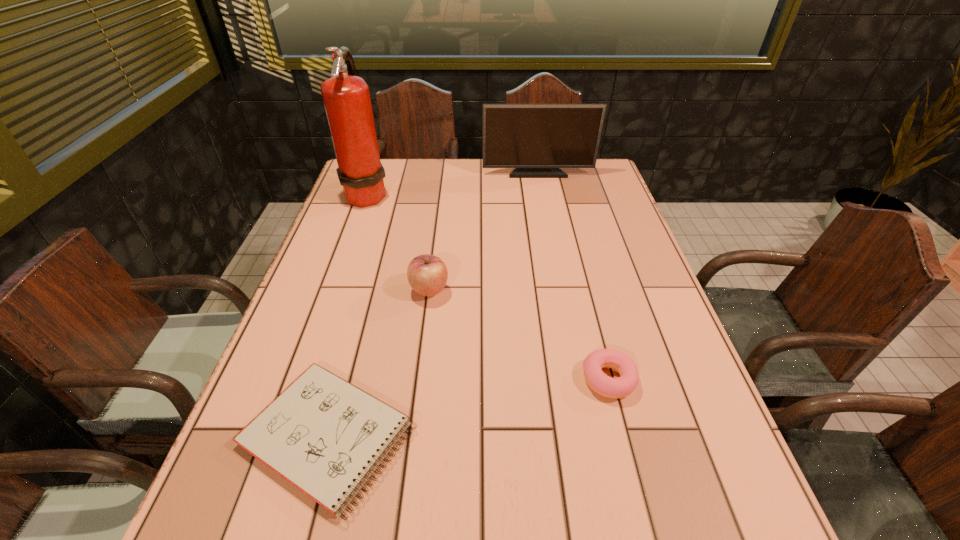
Where is `the tallest object`? the tallest object is located at coordinates (346, 97).

At what (x,y) coordinates should I click in order to perform the action: click on the fourth nearest object. Please return your answer as a coordinate pair (x, y). Looking at the image, I should click on (346, 97).

This screenshot has width=960, height=540. Identify the location of the fourth shortest object. (537, 140).

You are a GUI agent. You are given a task and a screenshot of the screen. Output one action in this format:
    pyautogui.click(x=<x>, y=<y>)
    Task: Click on the farthest object
    The height and width of the screenshot is (540, 960).
    Given the screenshot: What is the action you would take?
    pyautogui.click(x=537, y=140)

You are a GUI agent. You are given a task and a screenshot of the screen. Output one action in this format:
    pyautogui.click(x=<x>, y=<y>)
    Task: Click on the apple
    The height and width of the screenshot is (540, 960).
    Given the screenshot: What is the action you would take?
    pyautogui.click(x=427, y=274)

Where is `the third tallest object`? The width and height of the screenshot is (960, 540). the third tallest object is located at coordinates (427, 274).

At what (x,y) coordinates should I click in order to perform the action: click on the second shortest object. Please return your answer as a coordinate pair (x, y). The height and width of the screenshot is (540, 960). Looking at the image, I should click on (598, 381).

At what (x,y) coordinates should I click in order to perform the action: click on notepad. Please return your answer as a coordinate pair (x, y). Looking at the image, I should click on (324, 435).

Locate an element on the screen. The image size is (960, 540). vacant space located 0.180m at the nozzle of the fire extinguisher is located at coordinates (446, 193).

You are a GUI agent. You are given a task and a screenshot of the screen. Output one action in this format:
    pyautogui.click(x=<x>, y=<y>)
    Task: Click on the vacant space located 0.260m on the screen side of the farthest object
    The width and height of the screenshot is (960, 540).
    Given the screenshot: What is the action you would take?
    pyautogui.click(x=547, y=222)